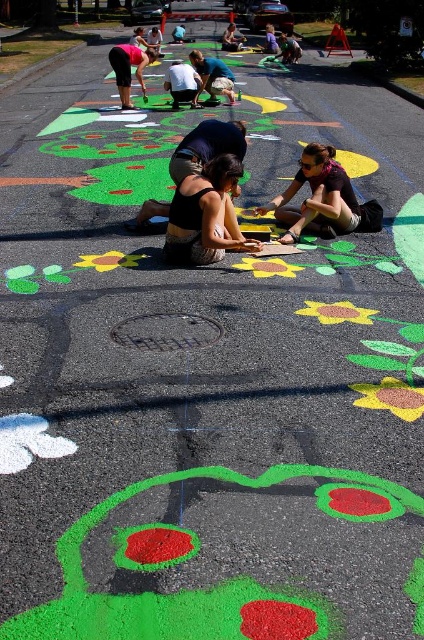
You are a photographer standing at the edge of the street painting scene. You want to take a photo that includes both the matte black tank top at center and the matte black shirt at center. Given that your camera has a maximum focus range of 35 inches, will you be able to capture both subjects in focus without moving closer?

The matte black tank top at center and the matte black shirt at center are 35.93 inches apart. Since the distance between them exceeds the camera focus range of 35 inches, you may need to adjust your position to ensure both are within the focus range.

You are a photographer standing at the edge of the road, and you want to capture a photo of the matte black shirt at center and the matte black shorts at upper left. Which object should you focus on first to ensure both are in the frame?

The matte black shirt at center is in front of the matte black shorts at upper left, so you should focus on the matte black shirt at center first to ensure both are in the frame.